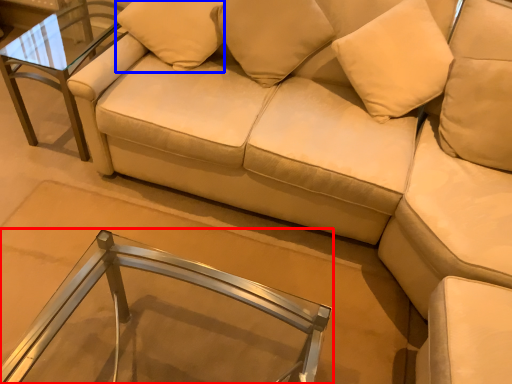
Question: Among these objects, which one is farthest to the camera, table (highlighted by a red box) or pillow (highlighted by a blue box)?

Choices:
 (A) table
 (B) pillow

Answer: (B)